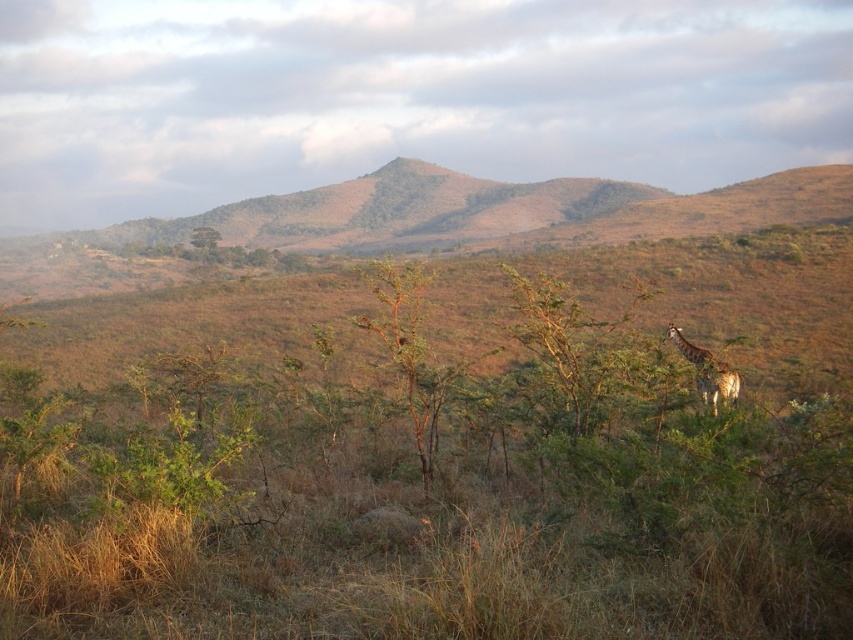
Question: Among these objects, which one is nearest to the camera?

Choices:
 (A) spotted fur giraffe at right
 (B) green leafy tree at upper center

Answer: (A)

Question: In this image, where is spotted fur giraffe at right located relative to green leafy tree at upper center?

Choices:
 (A) right
 (B) left

Answer: (A)

Question: Which point appears closest to the camera in this image?

Choices:
 (A) (206, 241)
 (B) (723, 401)

Answer: (B)

Question: Considering the relative positions of spotted fur giraffe at right and green leafy tree at upper center in the image provided, where is spotted fur giraffe at right located with respect to green leafy tree at upper center?

Choices:
 (A) right
 (B) left

Answer: (A)

Question: From the image, what is the correct spatial relationship of spotted fur giraffe at right in relation to green leafy tree at upper center?

Choices:
 (A) above
 (B) below

Answer: (B)